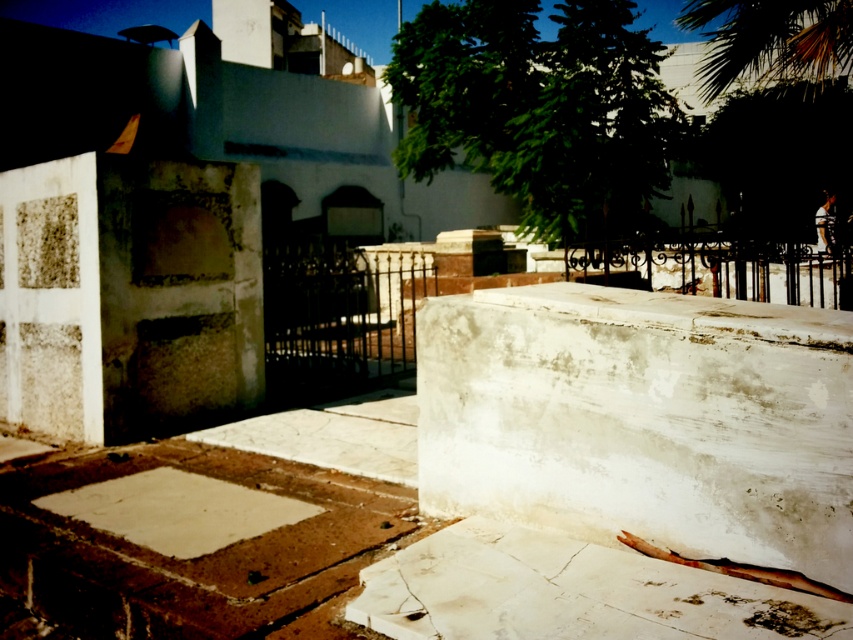
You are standing at the origin point of the coordinate system in this image. You want to place a new decorative stone exactly 0.2 units to the right of the white marble block at center. What are the coordinates of the new stone?

The white marble block at center is located at coordinates point [643,419]. Adding 0.2 units to the x coordinate gives 0.856. The new coordinates are [643,547].

From the picture: You are standing at the entrance of the cemetery and want to take a photo of both the white marble block at center and the green leafy palm tree at upper right. Which object should you focus on first if you want to include both in your frame without moving the camera?

The white marble block at center is not as tall as the green leafy palm tree at upper right, so you should focus on the green leafy palm tree at upper right first to ensure it fits in the frame along with the shorter white marble block at center.